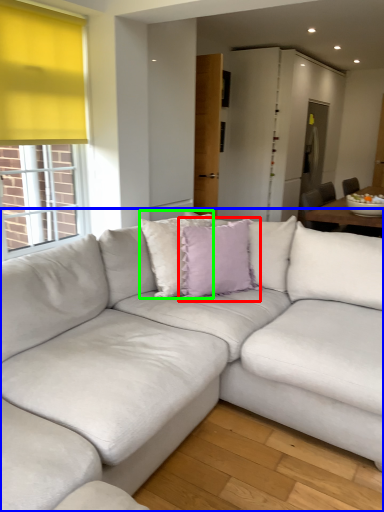
Question: Which is nearer to the pillow (highlighted by a red box)? studio couch (highlighted by a blue box) or pillow (highlighted by a green box).

Choices:
 (A) studio couch
 (B) pillow

Answer: (B)